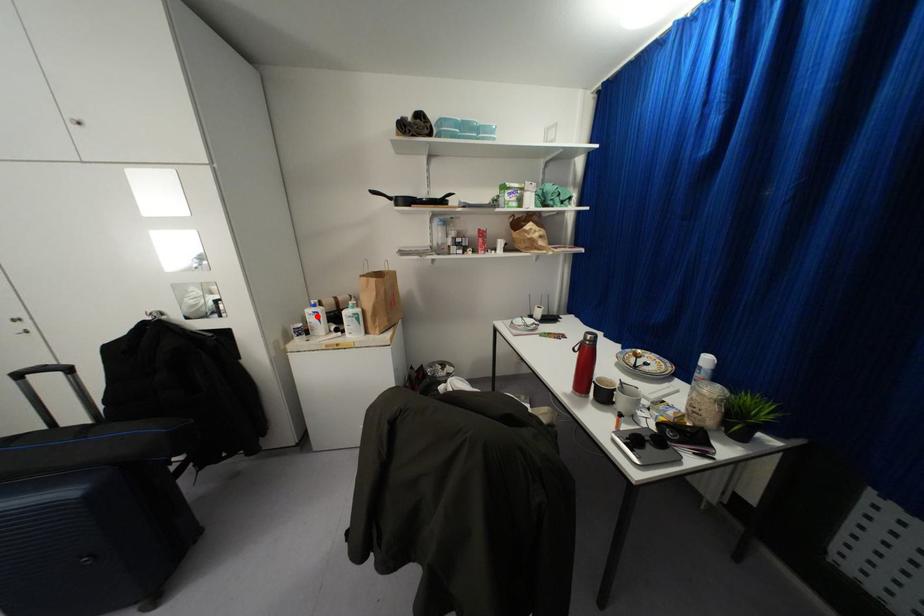
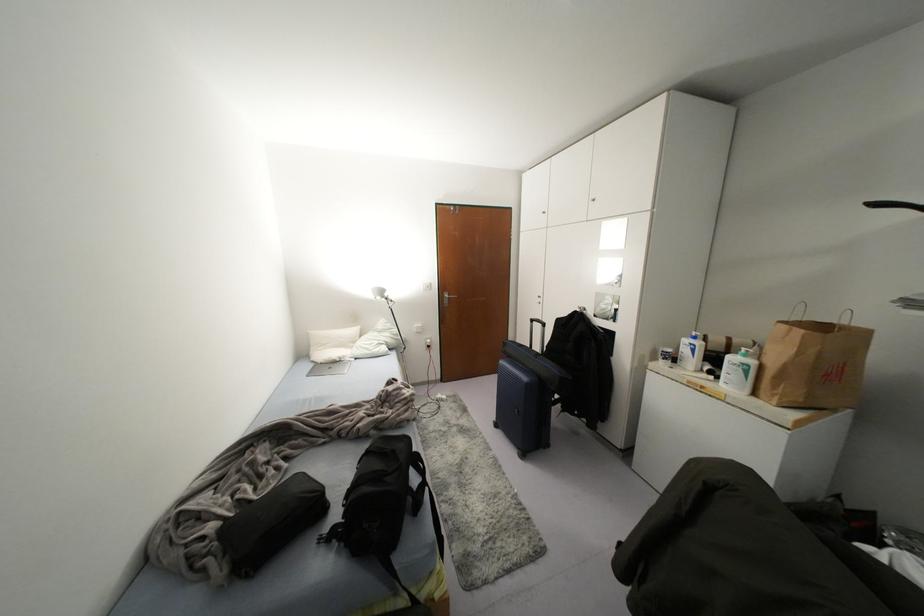
The point at the highlighted location is marked in the first image. Where is the corresponding point in the second image?

(691, 350)